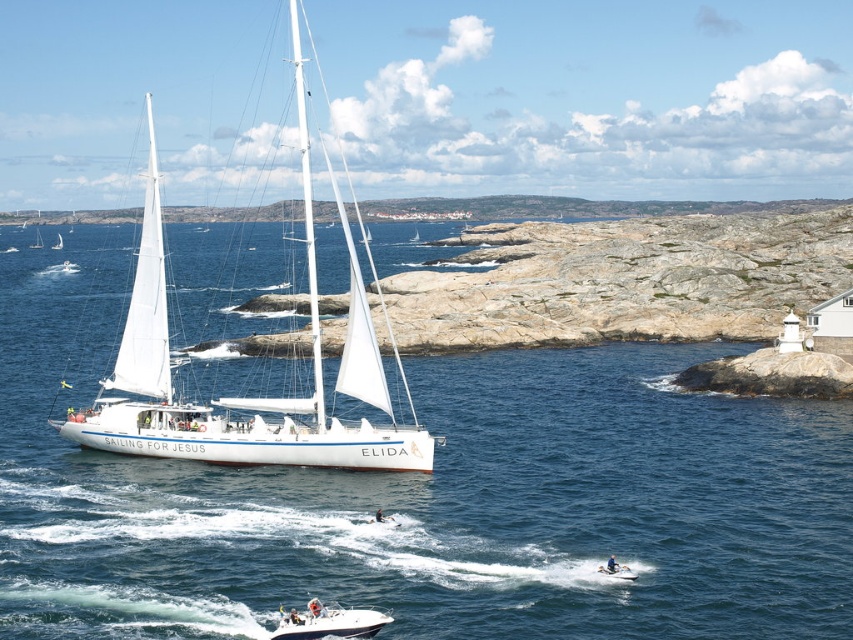
Looking at this image, you are a photographer standing on the deck of the sailboat ELIDA. You want to take a photo that includes both the jet ski and the motorboat. The jet ski is located at point (x=234, y=328) and the motorboat is at point (x=393, y=435). Which of these two points is closer to your camera position?

Point (x=234, y=328) is closer to the camera than point (x=393, y=435) because it is further to the camera than the other point.

You are standing on the deck of the sailboat ELIDA and looking out towards the two points marked in the scene. Which point, point [300,564] or point [36,230], is closer to your current position?

Point [300,564] is closer to the camera than point [36,230], so the point closer to your current position on the deck of the sailboat ELIDA is point [300,564].